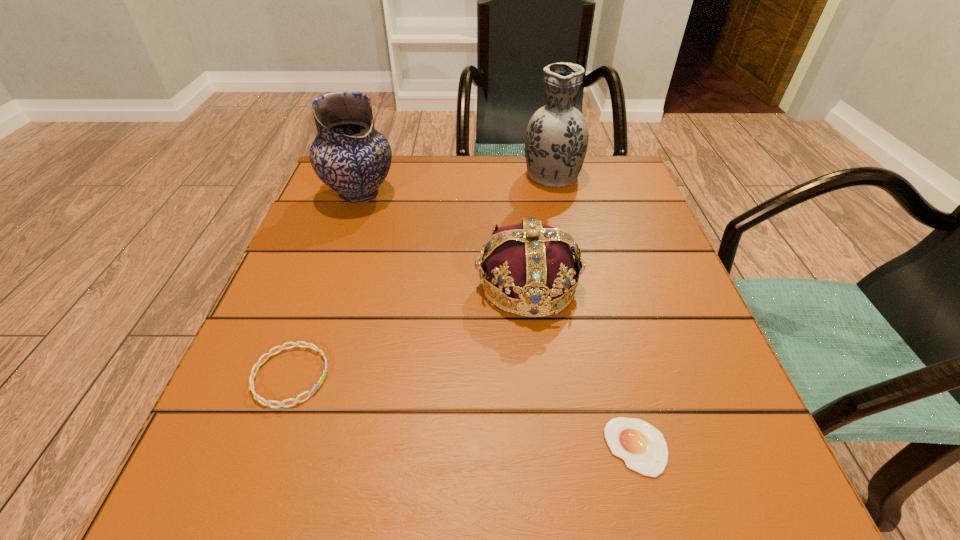
Locate an element on the screen. The height and width of the screenshot is (540, 960). object that is at the far right corner is located at coordinates 556,141.

Find the location of `object located at the near right corner`. object located at the near right corner is located at coordinates (643, 448).

The width and height of the screenshot is (960, 540). Identify the location of free space at the far edge of the desktop. (507, 176).

This screenshot has height=540, width=960. In order to click on free space at the left edge of the desktop in this screenshot , I will do `click(340, 300)`.

This screenshot has height=540, width=960. In order to click on vacant region at the right edge of the desktop in this screenshot , I will do `click(632, 276)`.

Find the location of a particular element. This screenshot has height=540, width=960. free space at the far left corner of the desktop is located at coordinates (320, 207).

This screenshot has width=960, height=540. In the image, there is a desktop. Find the location of `vacant space at the near left corner`. vacant space at the near left corner is located at coordinates (295, 506).

The width and height of the screenshot is (960, 540). What are the coordinates of `free space at the far right corner` in the screenshot? It's located at (601, 158).

You are a GUI agent. You are given a task and a screenshot of the screen. Output one action in this format:
    pyautogui.click(x=<x>, y=<y>)
    Task: Click on the free space between the nearest object and the crown
    The width and height of the screenshot is (960, 540).
    Given the screenshot: What is the action you would take?
    pyautogui.click(x=582, y=366)

At what (x,y) coordinates should I click in order to perform the action: click on free space between the shortest object and the vase. Please return your answer as a coordinate pair (x, y). The width and height of the screenshot is (960, 540). Looking at the image, I should click on (594, 310).